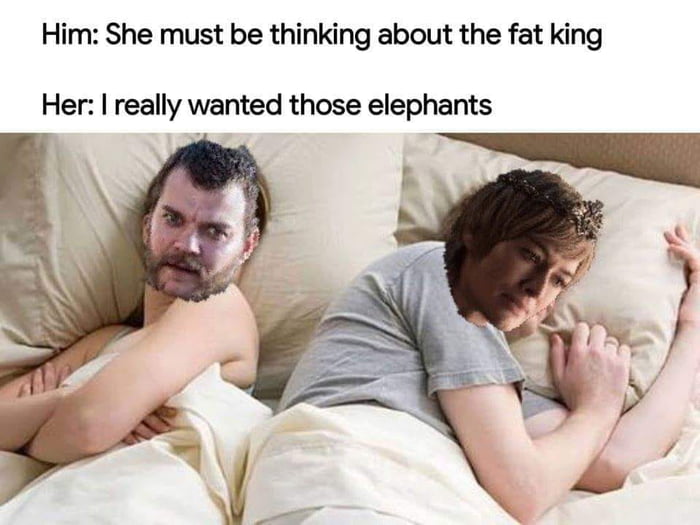
This screenshot has height=525, width=700. Find the location of `pillow`. pillow is located at coordinates (343, 207), (630, 264).